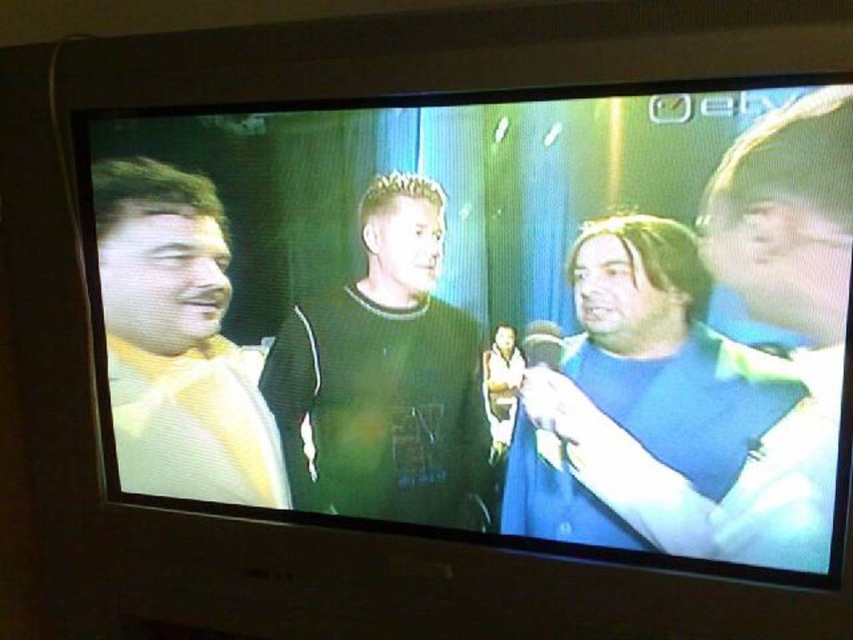
You are watching a talk show on a TV screen. You see a blue matte shirt at right and a dark green sweater at center. Which clothing item is positioned higher on the screen?

The blue matte shirt at right is above the dark green sweater at center, so the blue matte shirt at right is positioned higher on the screen.

You are a camera operator adjusting the focus on the television screen. You need to focus on both the blue matte shirt at right and the dark green sweater at center. Which one should you focus on first to ensure both are in focus?

You should focus on the dark green sweater at center first because the blue matte shirt at right is in front of it, so adjusting focus starting from the closer object will help ensure both are in focus.

You are designing a poster for a talk show and need to ensure the spacing between the matte black shirt at center and dark green sweater at center is exactly 10 centimeters. According to the current image, is the spacing sufficient? Please explain.

The matte black shirt at center is currently 8.50 centimeters from the dark green sweater at center. Since 8.50 cm is less than the required 10 cm, the spacing is not sufficient and needs to be increased by 1.50 centimeters to meet the design requirement.